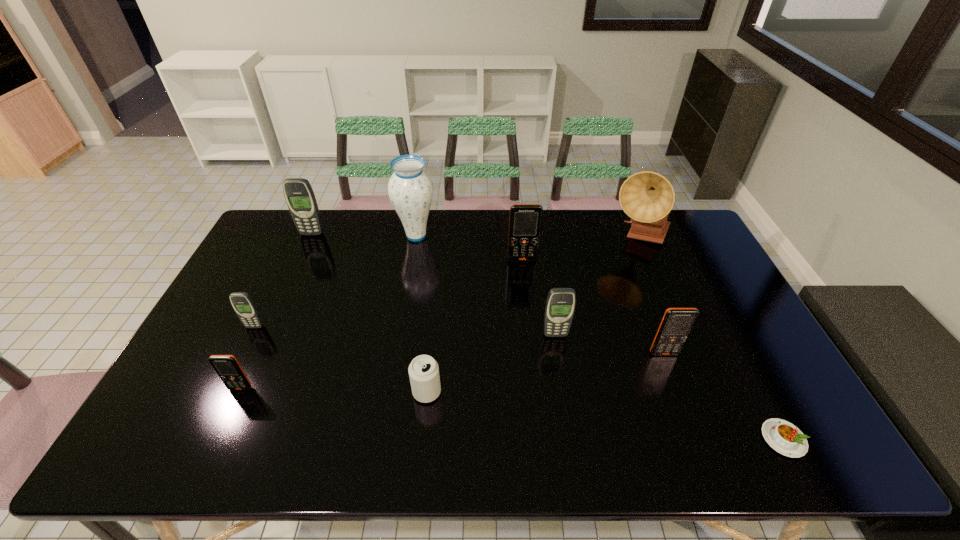
The image size is (960, 540). Identify the location of phonograph record. (647, 197).

At what (x,y) coordinates should I click in order to perform the action: click on blue vase. Please return your answer as a coordinate pair (x, y). The height and width of the screenshot is (540, 960). Looking at the image, I should click on (410, 189).

I want to click on the biggest orange cellular telephone, so click(x=525, y=220).

The height and width of the screenshot is (540, 960). What are the coordinates of `the fourth farthest object` in the screenshot? It's located at (525, 220).

Locate an element on the screen. This screenshot has width=960, height=540. the farthest cellular telephone is located at coordinates (299, 195).

In order to click on the farthest gray cellular telephone in this screenshot , I will do `click(299, 195)`.

Find the location of a particular element. This screenshot has height=540, width=960. the sixth farthest object is located at coordinates (560, 304).

Where is `the rightmost gray cellular telephone`? the rightmost gray cellular telephone is located at coordinates (560, 304).

Where is `the rightmost cellular telephone`? the rightmost cellular telephone is located at coordinates (677, 323).

Where is `the second biggest orange cellular telephone`? the second biggest orange cellular telephone is located at coordinates (677, 323).